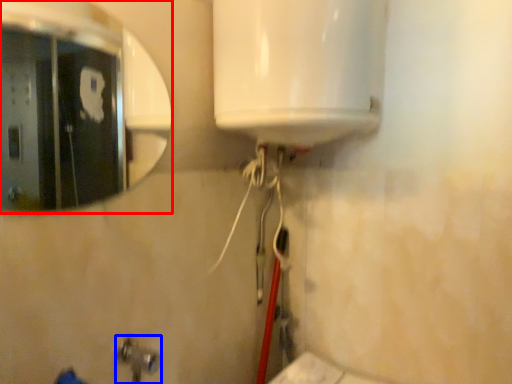
Question: Among these objects, which one is farthest to the camera, mirror (highlighted by a red box) or plumbing fixture (highlighted by a blue box)?

Choices:
 (A) mirror
 (B) plumbing fixture

Answer: (A)